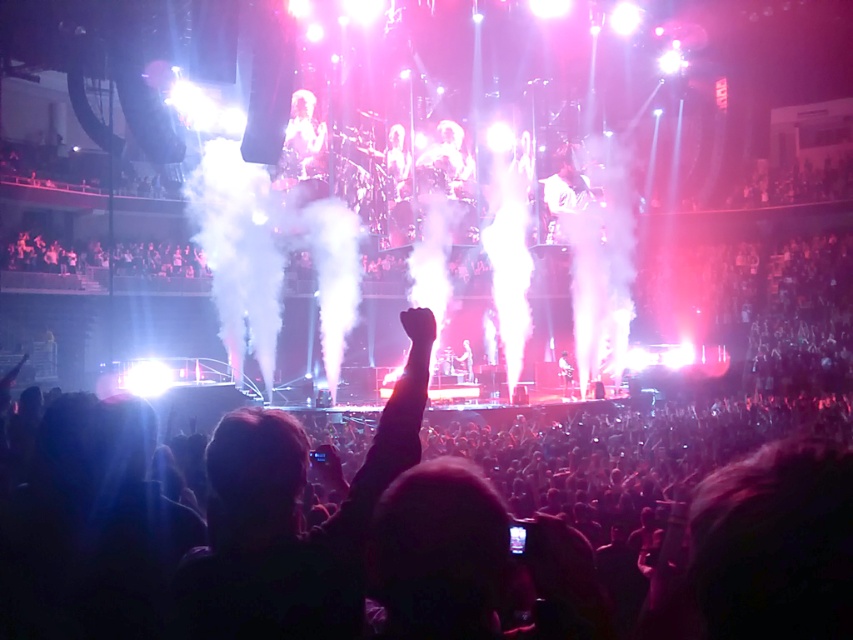
Question: Which of these objects is positioned farthest from the shiny black guitar at center?

Choices:
 (A) white fog at center
 (B) shiny silver guitar at center

Answer: (A)

Question: Which of the following is the closest to the observer?

Choices:
 (A) shiny black guitar at center
 (B) shiny silver guitar at center
 (C) white fog at center

Answer: (C)

Question: Is the position of shiny black guitar at center less distant than that of shiny silver guitar at center?

Choices:
 (A) yes
 (B) no

Answer: (A)

Question: Does white fog at center appear on the left side of shiny silver guitar at center?

Choices:
 (A) no
 (B) yes

Answer: (B)

Question: Does shiny black guitar at center appear on the left side of shiny silver guitar at center?

Choices:
 (A) yes
 (B) no

Answer: (B)

Question: Among these points, which one is farthest from the camera?

Choices:
 (A) 466,356
 (B) 566,392
 (C) 221,262

Answer: (A)